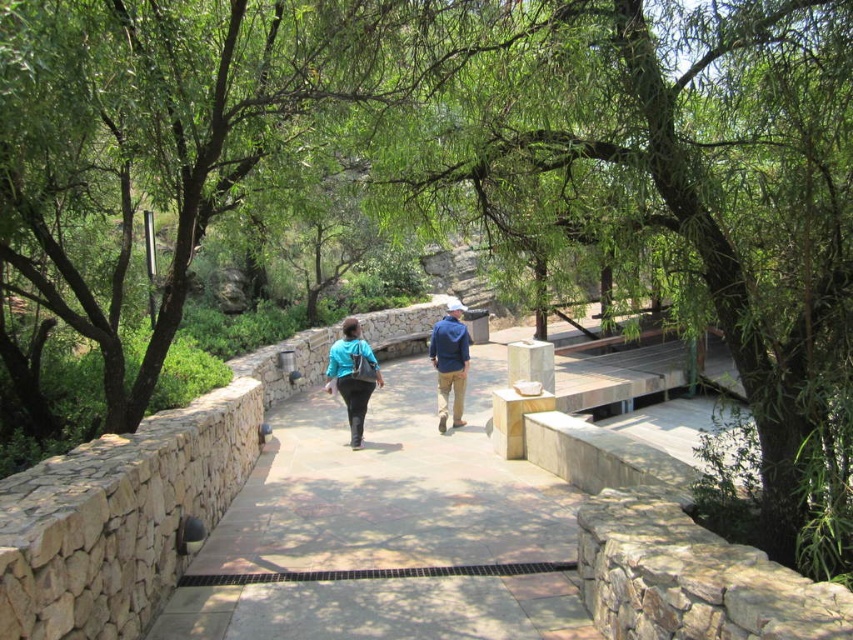
Question: Where is green leafy tree at center located in relation to blue denim jacket at center in the image?

Choices:
 (A) right
 (B) left

Answer: (A)

Question: Does brown stone path at center appear over blue fabric jacket at center?

Choices:
 (A) yes
 (B) no

Answer: (B)

Question: Among these objects, which one is nearest to the camera?

Choices:
 (A) blue denim jacket at center
 (B) green leafy tree at center

Answer: (B)

Question: Which is farther from the blue denim jacket at center?

Choices:
 (A) blue fabric jacket at center
 (B) brown stone path at center
 (C) matte blue jacket at center

Answer: (B)

Question: Which point is closer to the camera?

Choices:
 (A) (453, 376)
 (B) (338, 364)

Answer: (B)

Question: Is brown stone path at center to the left of matte blue jacket at center from the viewer's perspective?

Choices:
 (A) no
 (B) yes

Answer: (A)